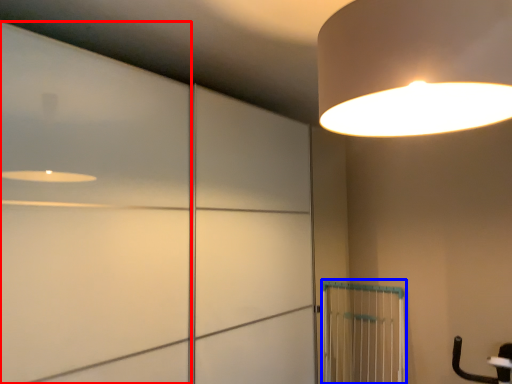
Question: Which point is further to the camera, door (highlighted by a red box) or cage (highlighted by a blue box)?

Choices:
 (A) door
 (B) cage

Answer: (B)